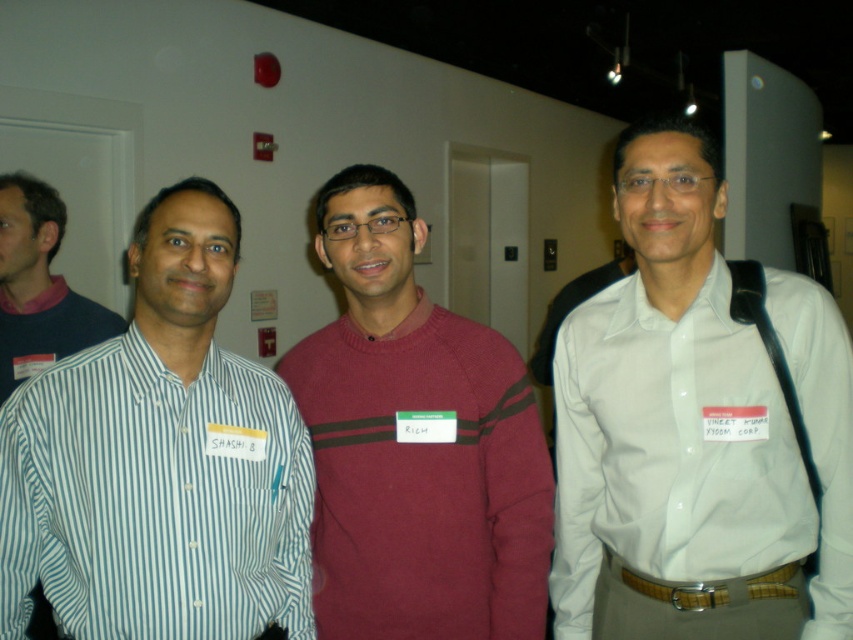
In the scene shown: You are organizing a photo shoot and need to arrange the white striped shirt at left and the white cotton shirt at right in a way that accounts for their sizes. Which shirt should be placed in a position where height matters to avoid looking disproportionate?

The white striped shirt at left should be placed in a lower position since it has a lesser height compared to the white cotton shirt at right, ensuring they appear proportionate in the photo shoot arrangement.

You are at a conference and need to find the person wearing the white cotton shirt at right. Which direction should you move from the white striped shirt at left to locate them?

The white cotton shirt at right is to the right of the white striped shirt at left. To locate them, move to the right from the white striped shirt at left.